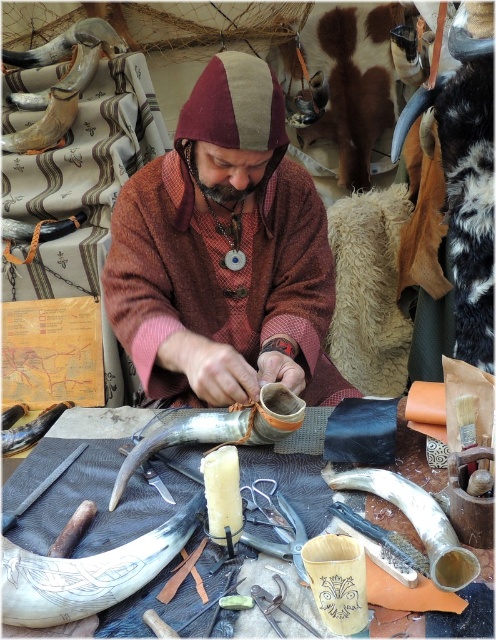
Question: Is matte brown leather boot at center wider than shiny silver horn at lower right?

Choices:
 (A) yes
 (B) no

Answer: (A)

Question: Which of these objects is positioned farthest from the smooth horn at center?

Choices:
 (A) shiny silver horn at lower right
 (B) polished horn at lower left

Answer: (B)

Question: Is matte brown leather boot at center smaller than smooth horn at center?

Choices:
 (A) yes
 (B) no

Answer: (B)

Question: Is carved bone horn at lower left above smooth horn at center?

Choices:
 (A) no
 (B) yes

Answer: (A)

Question: Which of the following is the farthest from the observer?

Choices:
 (A) polished horn at lower left
 (B) smooth horn at center

Answer: (A)

Question: Which point appears farthest from the camera in this image?

Choices:
 (A) (209, 385)
 (B) (418, 518)
 (C) (280, 636)
 (D) (185, 440)

Answer: (D)